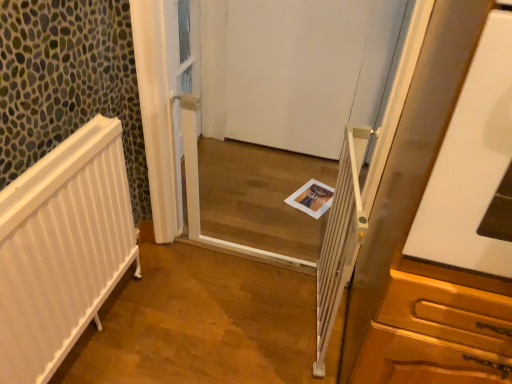
The width and height of the screenshot is (512, 384). In order to click on free space to the left of white plastic balustrade at center in this screenshot , I will do `click(246, 327)`.